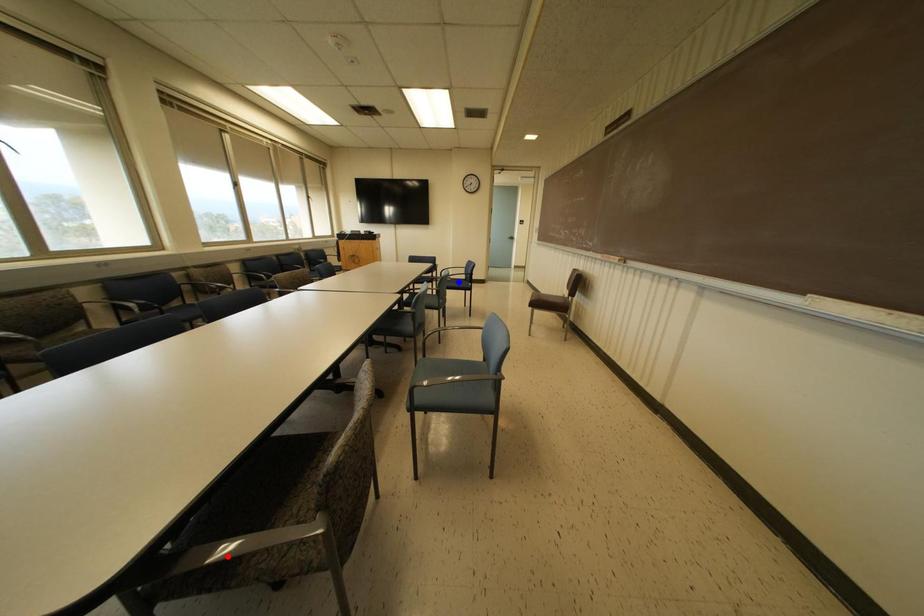
Question: Two points are marked on the image. Which point is closer to the camera?

Choices:
 (A) Blue point is closer.
 (B) Red point is closer.

Answer: (B)